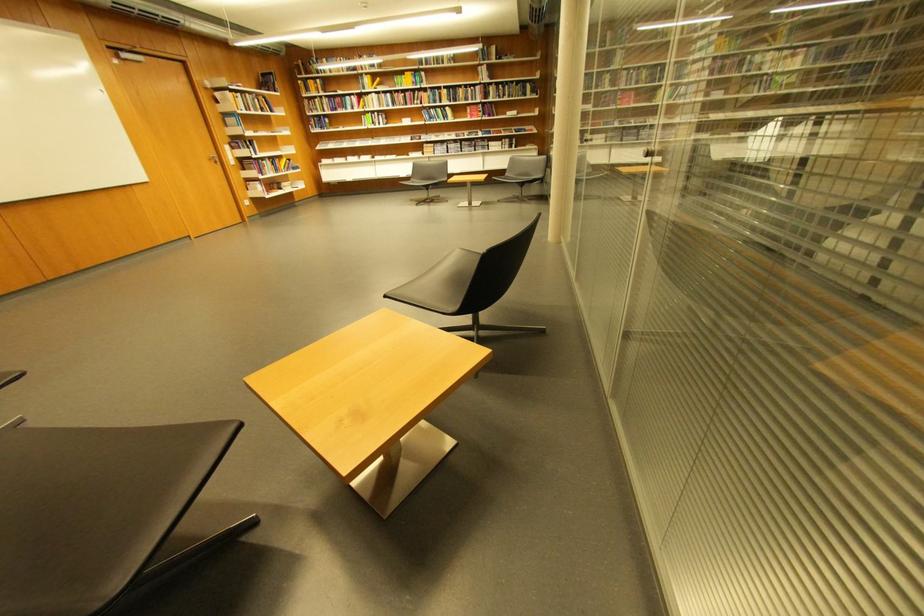
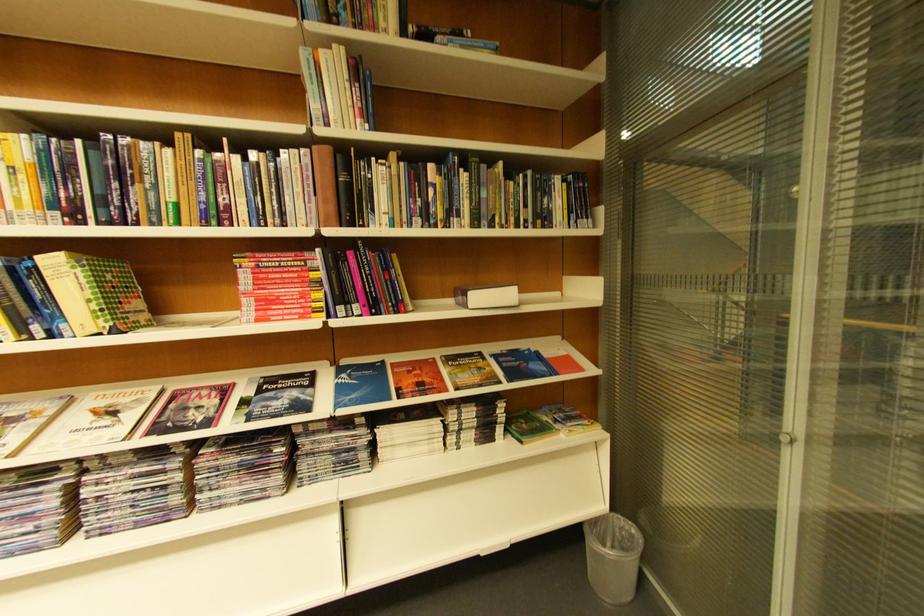
Locate, in the second image, the point that corresponds to the point at 482,108 in the first image.

(281, 262)